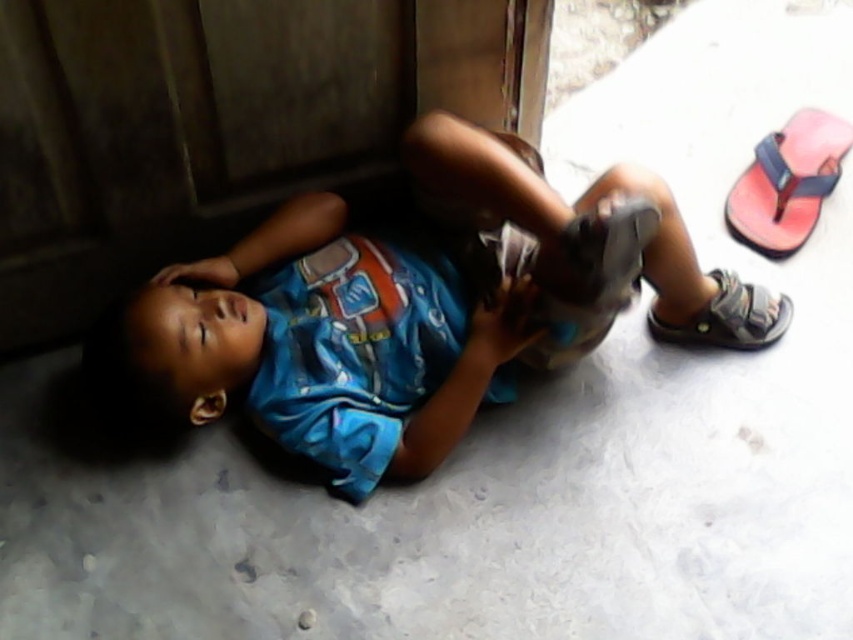
Does blue printed shirt at lower center have a greater width compared to pink rubber sandal at upper right?

Yes, blue printed shirt at lower center is wider than pink rubber sandal at upper right.

Does blue printed shirt at lower center come in front of pink rubber sandal at upper right?

That is True.

The width and height of the screenshot is (853, 640). Describe the element at coordinates (399, 305) in the screenshot. I see `blue printed shirt at lower center` at that location.

Locate an element on the screen. blue printed shirt at lower center is located at coordinates (399, 305).

Can you confirm if blue printed shirt at lower center is smaller than gray fabric sandal at lower right?

No.

The image size is (853, 640). Identify the location of blue printed shirt at lower center. (399, 305).

Locate an element on the screen. Image resolution: width=853 pixels, height=640 pixels. blue printed shirt at lower center is located at coordinates (399, 305).

Does pink rubber sandal at upper right have a larger size compared to gray fabric sandal at lower right?

Correct, pink rubber sandal at upper right is larger in size than gray fabric sandal at lower right.

Measure the distance between pink rubber sandal at upper right and camera.

1.42 meters

Locate an element on the screen. The height and width of the screenshot is (640, 853). pink rubber sandal at upper right is located at coordinates (787, 182).

You are a GUI agent. You are given a task and a screenshot of the screen. Output one action in this format:
    pyautogui.click(x=<x>, y=<y>)
    Task: Click on the pink rubber sandal at upper right
    The image size is (853, 640).
    Given the screenshot: What is the action you would take?
    pyautogui.click(x=787, y=182)